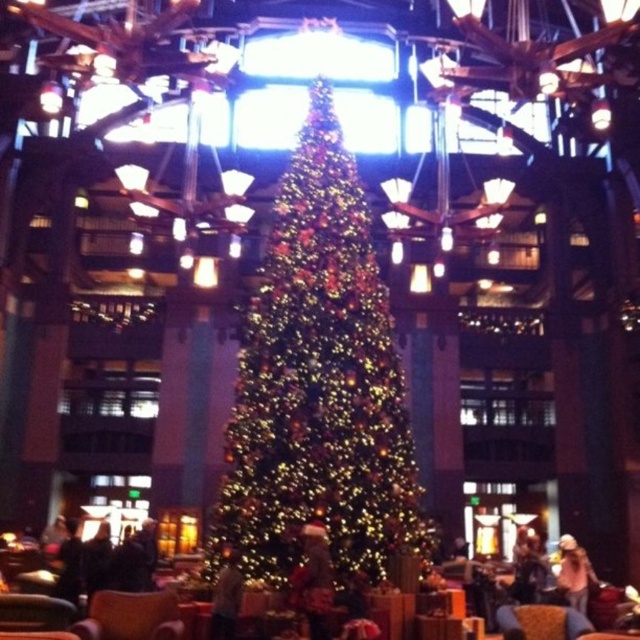
Question: Is the position of iridescent gold christmas tree at center less distant than that of brown leather armchair at lower center?

Choices:
 (A) no
 (B) yes

Answer: (A)

Question: Is brown leather armchair at lower center above fuzzy brown coat at center?

Choices:
 (A) no
 (B) yes

Answer: (A)

Question: Among these points, which one is farthest from the camera?

Choices:
 (A) (308, 634)
 (B) (227, 573)
 (C) (148, 612)

Answer: (B)

Question: Among these points, which one is farthest from the camera?

Choices:
 (A) (300, 212)
 (B) (301, 540)
 (C) (225, 563)

Answer: (A)

Question: Which object is the farthest from the denim jacket at lower right?

Choices:
 (A) light brown leather jacket at lower center
 (B) iridescent gold christmas tree at center
 (C) fuzzy brown coat at center
 (D) brown leather armchair at lower center

Answer: (D)

Question: Can you confirm if iridescent gold christmas tree at center is positioned to the right of light brown leather jacket at lower center?

Choices:
 (A) no
 (B) yes

Answer: (B)